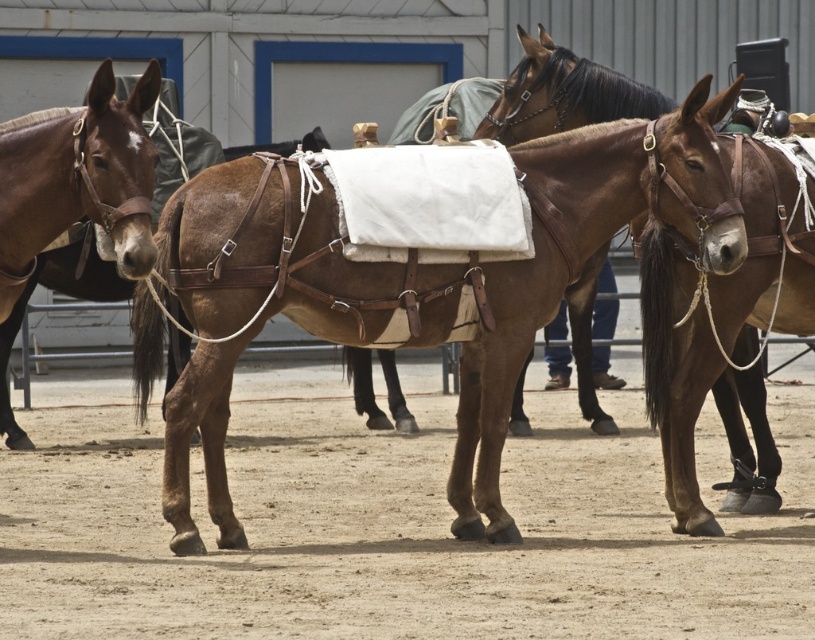
You are trying to place the brown leather saddle at center onto the brown leather horse at center. Based on their sizes, will the saddle fit properly?

The brown leather saddle at center might be wider than brown leather horse at center, so it may not fit properly and could require adjustment or a different saddle.

You are a stable hand checking the equipment of the brown leather horse at center. Where is the brown leather saddle at center positioned relative to the horse?

The brown leather saddle at center is located below the brown leather horse at center, meaning it is placed underneath the horse.